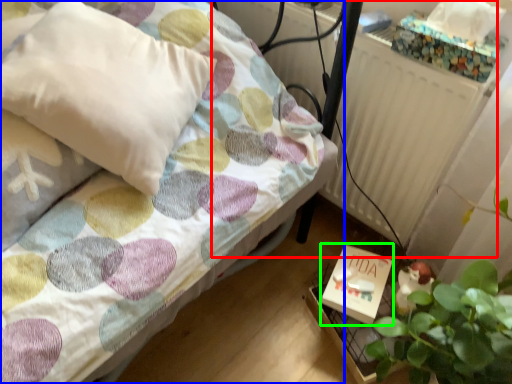
Question: Considering the real-world distances, which object is farthest from radiator (highlighted by a red box)? bed (highlighted by a blue box) or box (highlighted by a green box)?

Choices:
 (A) bed
 (B) box

Answer: (A)